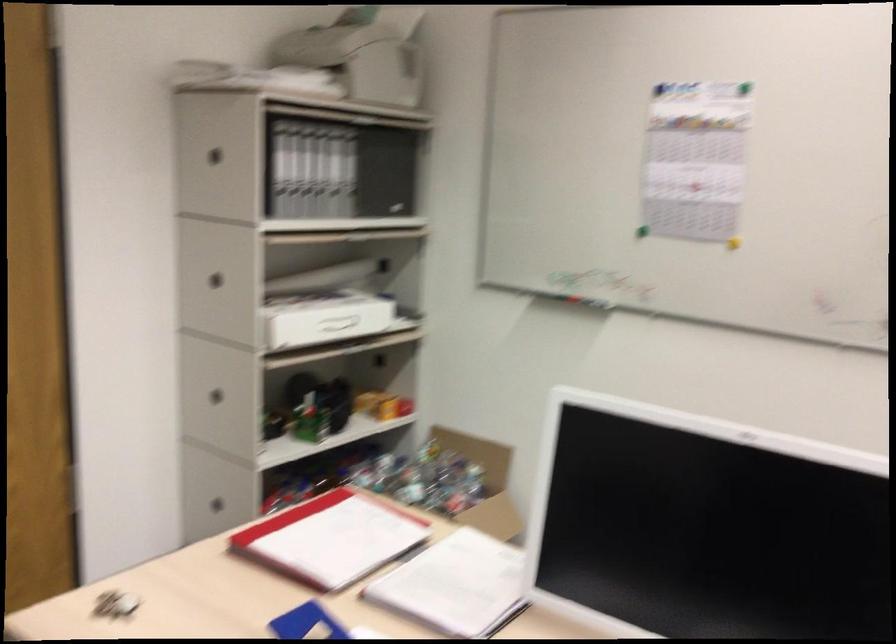
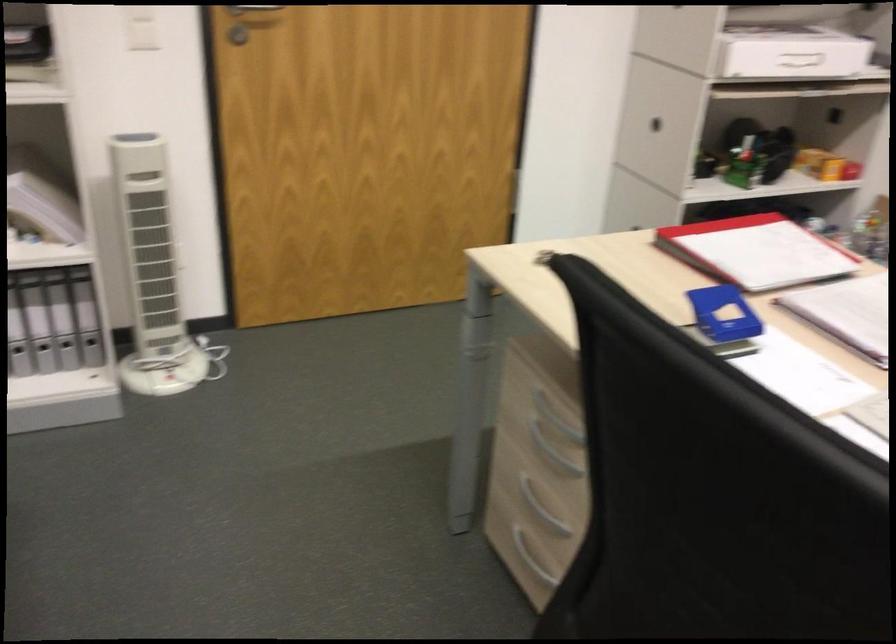
Where in the second image is the point corresponding to (375,359) from the first image?

(833, 116)